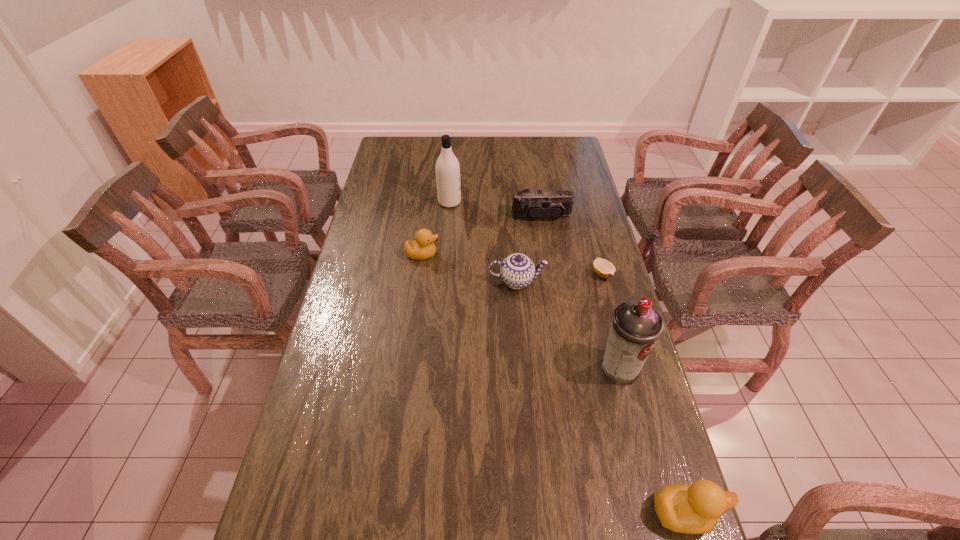
Locate an element on the screen. the left duckling is located at coordinates (422, 248).

Identify the location of the farther duckling. Image resolution: width=960 pixels, height=540 pixels. (422, 248).

Where is `the fifth shortest object`? This screenshot has width=960, height=540. the fifth shortest object is located at coordinates (696, 509).

In order to click on the taller duckling in this screenshot , I will do `click(696, 509)`.

You are a GUI agent. You are given a task and a screenshot of the screen. Output one action in this format:
    pyautogui.click(x=<x>, y=<y>)
    Task: Click on the shampoo
    This screenshot has height=540, width=960.
    Given the screenshot: What is the action you would take?
    pyautogui.click(x=447, y=167)

Identify the location of lemon. This screenshot has height=540, width=960. (603, 268).

Locate an element on the screen. This screenshot has width=960, height=540. camcorder is located at coordinates (536, 204).

Where is `chinaware`? Image resolution: width=960 pixels, height=540 pixels. chinaware is located at coordinates (517, 271).

The width and height of the screenshot is (960, 540). Find the location of `the second nearest object`. the second nearest object is located at coordinates (636, 326).

Locate an element on the screen. Image resolution: width=960 pixels, height=540 pixels. vacant space situated 0.090m on the face of the shorter duckling is located at coordinates (465, 254).